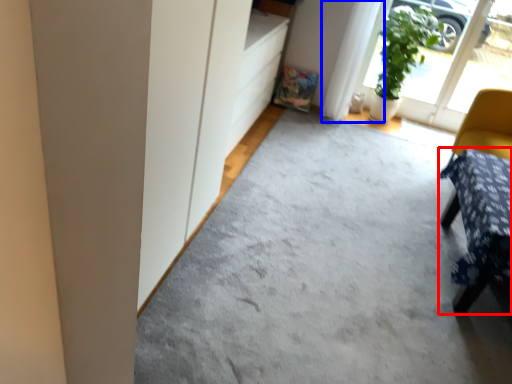
Question: Which of the following is the farthest to the observer, furniture (highlighted by a red box) or curtain (highlighted by a blue box)?

Choices:
 (A) furniture
 (B) curtain

Answer: (B)